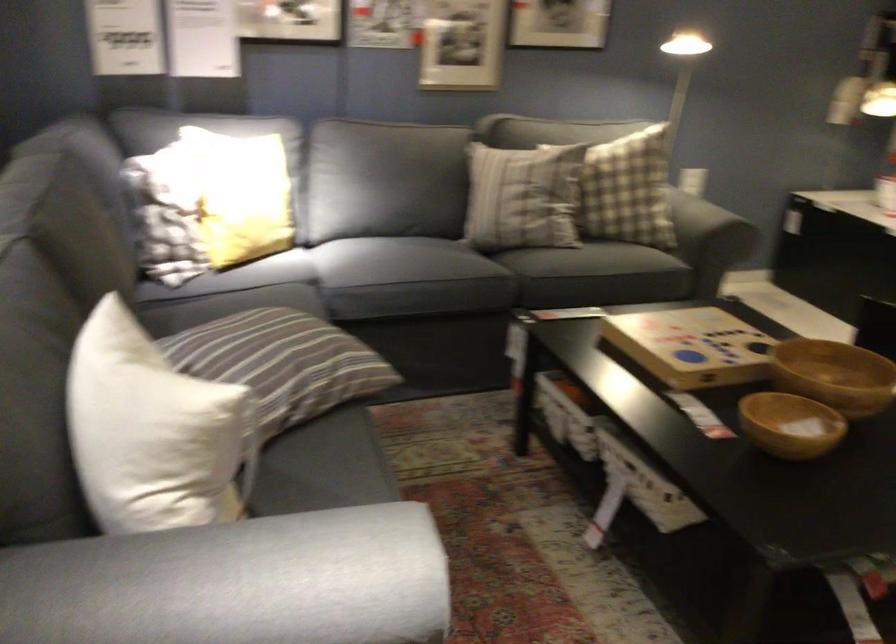
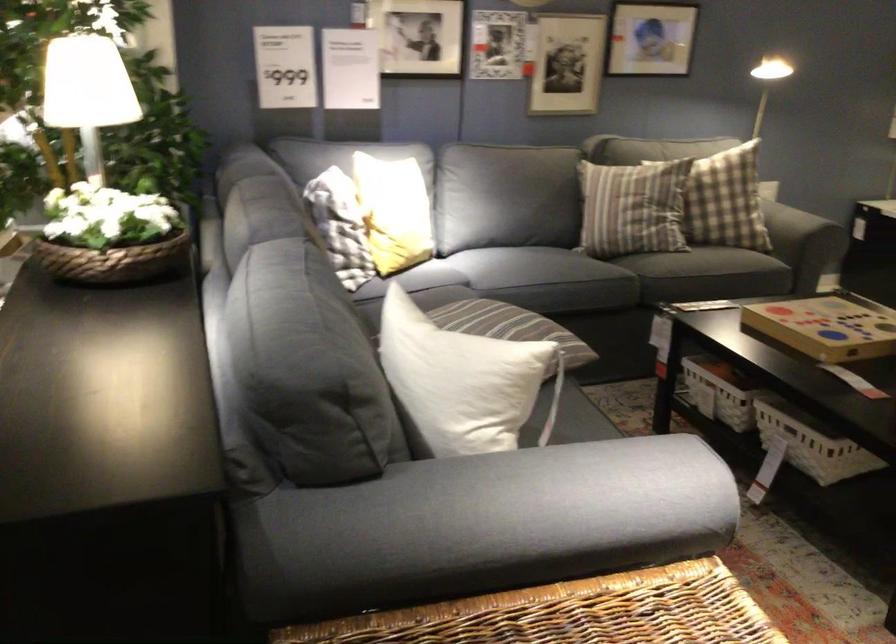
Where in the second image is the point corresponding to [501,205] from the first image?

(633, 207)